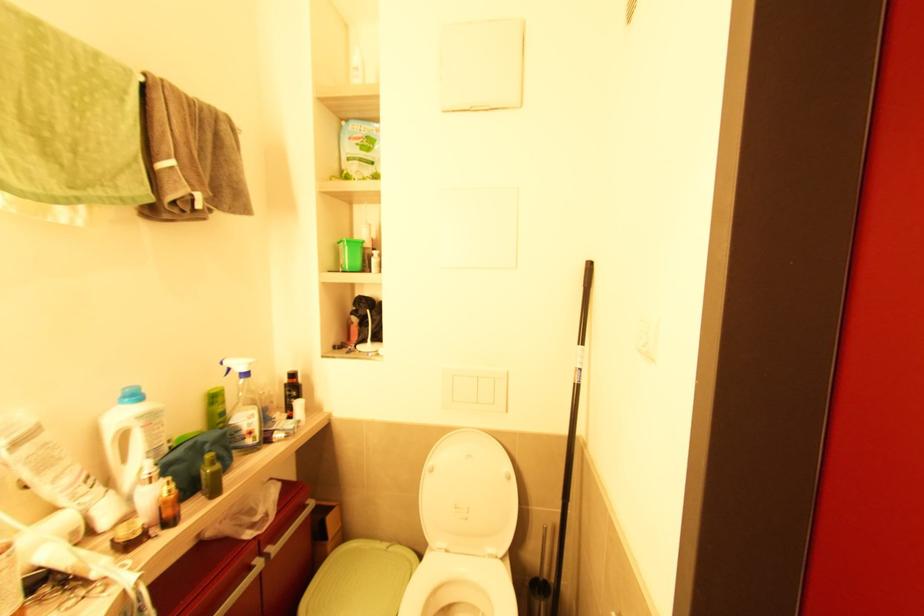
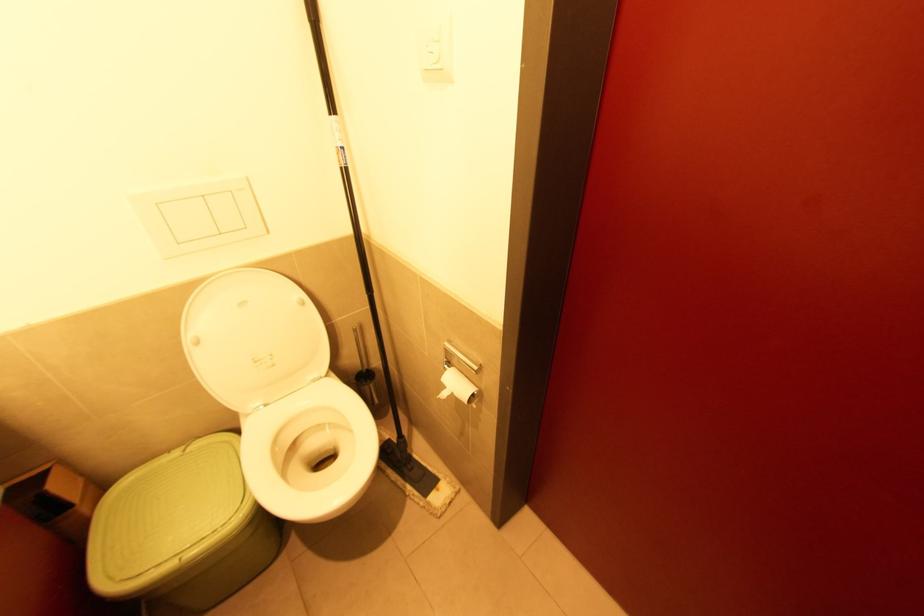
In the second image, find the point that corresponds to (503,560) in the first image.

(329, 377)